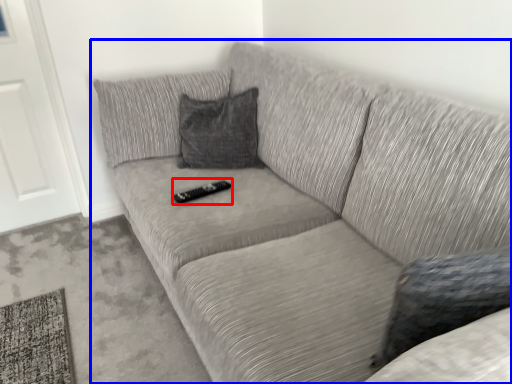
Question: Which object appears farthest to the camera in this image, remote (highlighted by a red box) or studio couch (highlighted by a blue box)?

Choices:
 (A) remote
 (B) studio couch

Answer: (A)